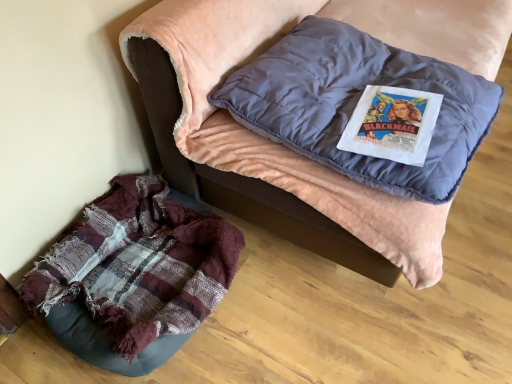
Find the location of a particular element. The image size is (512, 384). free space that is in between plaid fabric cushion at lower left and worn fabric bean bag at lower left is located at coordinates (275, 326).